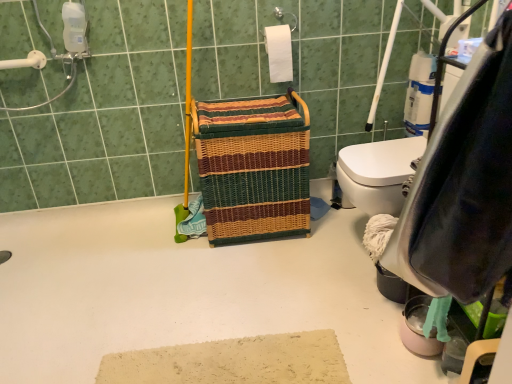
What do you see at coordinates (26, 61) in the screenshot?
I see `white plastic grab bar at upper left` at bounding box center [26, 61].

Measure the distance between point (288, 130) and camera.

They are 6.17 feet apart.

I want to click on white plastic grab bar at upper left, so click(x=26, y=61).

Would you say woven multicolored laundry basket at center is part of white plastic grab bar at upper left's contents?

No, woven multicolored laundry basket at center is not inside white plastic grab bar at upper left.

From a real-world perspective, is white plastic grab bar at upper left physically below woven multicolored laundry basket at center?

No.

In the scene shown: Who is shorter, white plastic grab bar at upper left or woven multicolored laundry basket at center?

white plastic grab bar at upper left is shorter.

Which of these two, white plastic grab bar at upper left or woven multicolored laundry basket at center, is bigger?

With larger size is woven multicolored laundry basket at center.

Could you measure the distance between woven multicolored laundry basket at center and white plastic grab bar at upper left?

woven multicolored laundry basket at center and white plastic grab bar at upper left are 3.49 feet apart.

Is woven multicolored laundry basket at center inside the boundaries of white plastic grab bar at upper left, or outside?

The correct answer is: outside.

From a real-world perspective, between woven multicolored laundry basket at center and white plastic grab bar at upper left, who is vertically higher?

white plastic grab bar at upper left, from a real-world perspective.

From the picture: Could you tell me if woven multicolored laundry basket at center is facing white plastic grab bar at upper left?

No, woven multicolored laundry basket at center does not turn towards white plastic grab bar at upper left.

From a real-world perspective, is white plastic grab bar at upper left located higher than white matte toilet paper at upper center?

Yes, from a real-world perspective, white plastic grab bar at upper left is on top of white matte toilet paper at upper center.

Is white plastic grab bar at upper left looking in the opposite direction of white matte toilet paper at upper center?

No, white plastic grab bar at upper left is not facing the opposite direction of white matte toilet paper at upper center.

Can you see white plastic grab bar at upper left touching white matte toilet paper at upper center?

No, white plastic grab bar at upper left is not next to white matte toilet paper at upper center.

Who is more distant, white plastic grab bar at upper left or white matte toilet paper at upper center?

Positioned behind is white matte toilet paper at upper center.

Can you confirm if white matte toilet paper at upper center is wider than woven multicolored laundry basket at center?

Incorrect, the width of white matte toilet paper at upper center does not surpass that of woven multicolored laundry basket at center.

Is white matte toilet paper at upper center turned away from woven multicolored laundry basket at center?

No.

Is point (289, 34) in front of point (253, 189)?

No.

The height and width of the screenshot is (384, 512). I want to click on laundry basket beneath the white matte toilet paper at upper center (from a real-world perspective), so click(253, 167).

Are white matte toilet paper at upper center and white plastic grab bar at upper left beside each other?

white matte toilet paper at upper center and white plastic grab bar at upper left are clearly separated.

Which is correct: white matte toilet paper at upper center is inside white plastic grab bar at upper left, or outside of it?

The correct answer is: outside.

Which is more to the right, white matte toilet paper at upper center or white plastic grab bar at upper left?

Positioned to the right is white matte toilet paper at upper center.

Can you confirm if white matte toilet paper at upper center is smaller than white plastic grab bar at upper left?

Incorrect, white matte toilet paper at upper center is not smaller in size than white plastic grab bar at upper left.

Are woven multicolored laundry basket at center and white matte toilet paper at upper center far apart?

Actually, woven multicolored laundry basket at center and white matte toilet paper at upper center are a little close together.

Can you confirm if woven multicolored laundry basket at center is bigger than white matte toilet paper at upper center?

Correct, woven multicolored laundry basket at center is larger in size than white matte toilet paper at upper center.

From the image's perspective, would you say woven multicolored laundry basket at center is shown under white matte toilet paper at upper center?

Yes, from the image's perspective, woven multicolored laundry basket at center is below white matte toilet paper at upper center.

From a real-world perspective, who is located lower, woven multicolored laundry basket at center or white matte toilet paper at upper center?

woven multicolored laundry basket at center, from a real-world perspective.

You are a GUI agent. You are given a task and a screenshot of the screen. Output one action in this format:
    pyautogui.click(x=<x>, y=<y>)
    Task: Click on the laundry basket in front of the white plastic grab bar at upper left
    The image size is (512, 384).
    Given the screenshot: What is the action you would take?
    pyautogui.click(x=253, y=167)

Find the location of a particular element. The width and height of the screenshot is (512, 384). shower that appears above the woven multicolored laundry basket at center (from the image's perspective) is located at coordinates (26, 61).

Considering their positions, is woven multicolored laundry basket at center positioned further to white matte toilet paper at upper center than white plastic grab bar at upper left?

The object further to white matte toilet paper at upper center is white plastic grab bar at upper left.

From the image, which object appears to be nearer to white plastic grab bar at upper left, woven multicolored laundry basket at center or white matte toilet paper at upper center?

woven multicolored laundry basket at center lies closer to white plastic grab bar at upper left than the other object.

Considering their positions, is white plastic grab bar at upper left positioned closer to white matte toilet paper at upper center than woven multicolored laundry basket at center?

woven multicolored laundry basket at center.

Which object lies further to the anchor point woven multicolored laundry basket at center, white plastic grab bar at upper left or white matte toilet paper at upper center?

Among the two, white plastic grab bar at upper left is located further to woven multicolored laundry basket at center.

From the picture: Considering their positions, is white matte toilet paper at upper center positioned closer to white plastic grab bar at upper left than woven multicolored laundry basket at center?

woven multicolored laundry basket at center lies closer to white plastic grab bar at upper left than the other object.

From the image, which object appears to be farther from woven multicolored laundry basket at center, white matte toilet paper at upper center or white plastic grab bar at upper left?

white plastic grab bar at upper left.

This screenshot has height=384, width=512. In order to click on laundry basket between white plastic grab bar at upper left and white matte toilet paper at upper center in this screenshot , I will do `click(253, 167)`.